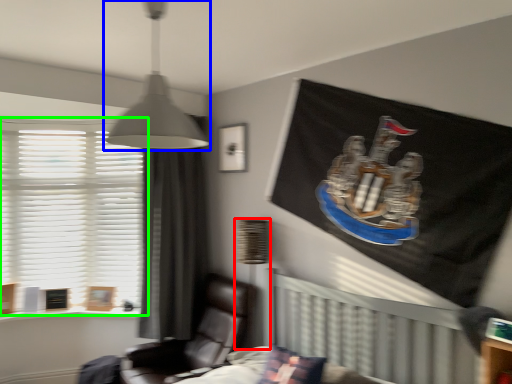
Question: Which is nearer to the table lamp (highlighted by a red box)? lamp (highlighted by a blue box) or window (highlighted by a green box).

Choices:
 (A) lamp
 (B) window

Answer: (A)